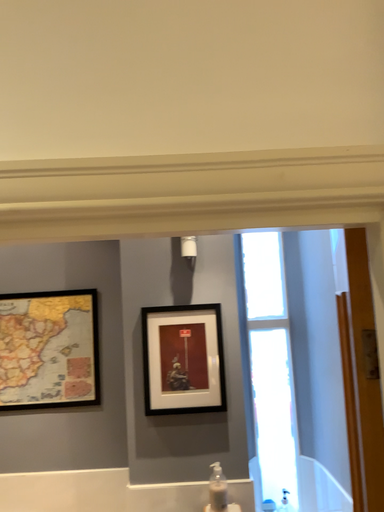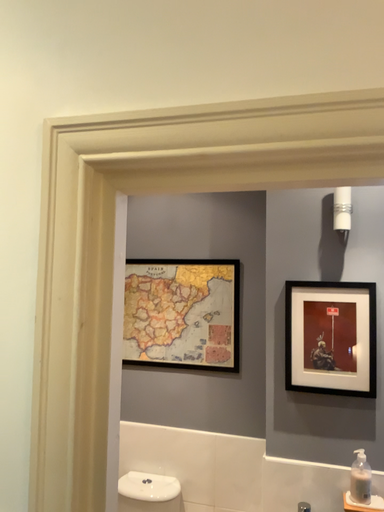
Question: How did the camera likely rotate when shooting the video?

Choices:
 (A) rotated right
 (B) rotated left

Answer: (B)